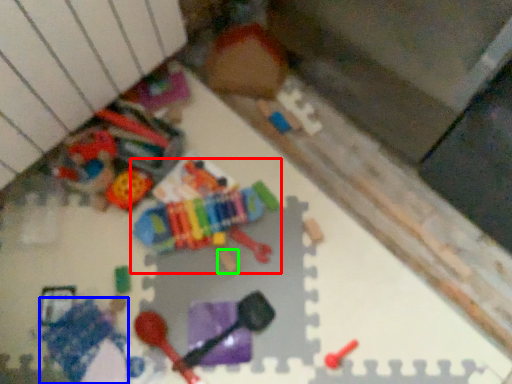
Question: Estimate the real-world distances between objects in this image. Which object is closer to toy (highlighted by a red box), toy (highlighted by a blue box) or toy (highlighted by a green box)?

Choices:
 (A) toy
 (B) toy

Answer: (B)